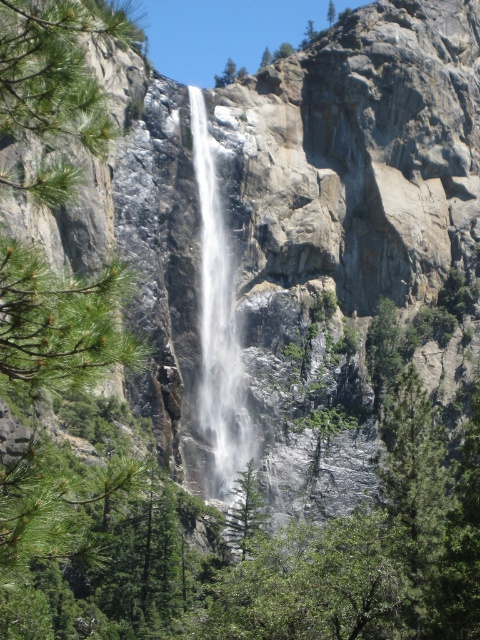
Identify the location of white frothy water at center. The image size is (480, 640). (217, 323).

Is white frothy water at center bigger than green leafy tree at center?

Indeed, white frothy water at center has a larger size compared to green leafy tree at center.

Find the location of a particular element. white frothy water at center is located at coordinates (217, 323).

Between green matte tree at center and green leafy tree at center, which one is positioned lower?

green matte tree at center is lower down.

Does point (243, 481) come behind point (328, 0)?

No.

Does point (240, 522) lie in front of point (328, 22)?

That is True.

This screenshot has width=480, height=640. In order to click on green matte tree at center in this screenshot , I will do `click(244, 513)`.

Does point (203, 198) lie behind point (253, 534)?

Yes.

Can you confirm if white frothy water at center is shorter than green matte tree at center?

No, white frothy water at center is not shorter than green matte tree at center.

Is point (213, 177) positioned after point (242, 472)?

Yes.

I want to click on white frothy water at center, so click(x=217, y=323).